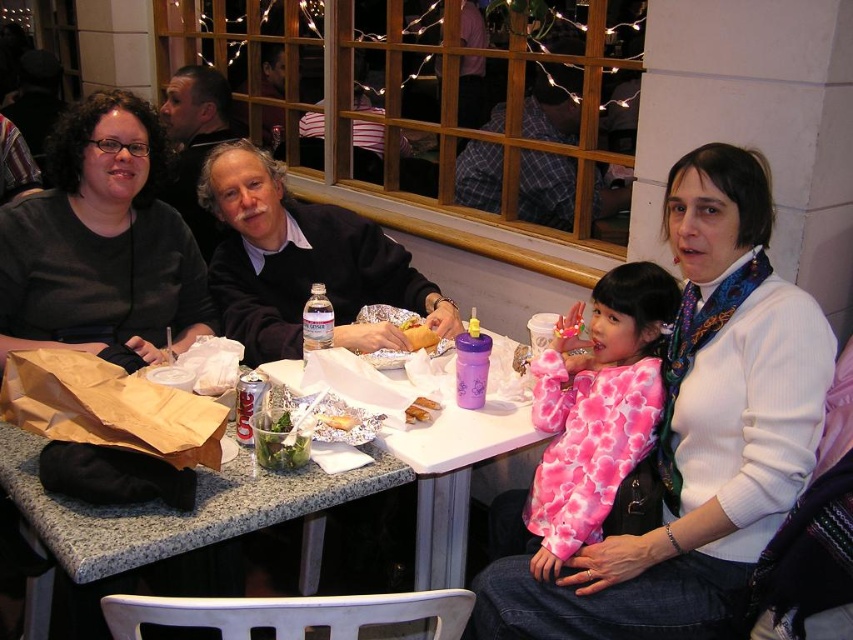
Between pink tie-dye sweater at center and gray knit sweater at center, which one appears on the right side from the viewer's perspective?

pink tie-dye sweater at center is more to the right.

Measure the distance between point (554,376) and camera.

The distance of point (554,376) from camera is 5.77 feet.

Does point (573, 536) come farther from viewer compared to point (212, 237)?

No, (573, 536) is in front of (212, 237).

Find the location of a particular element. The height and width of the screenshot is (640, 853). pink tie-dye sweater at center is located at coordinates (596, 406).

Based on the photo, does dark brown sweater at center appear under golden crispy bread at center?

A: Actually, dark brown sweater at center is above golden crispy bread at center.

Can you confirm if dark brown sweater at center is positioned to the right of golden crispy bread at center?

No, dark brown sweater at center is not to the right of golden crispy bread at center.

The image size is (853, 640). Identify the location of dark brown sweater at center. (303, 262).

Between matte black shirt at left and gray knit sweater at center, which one is positioned higher?

gray knit sweater at center

Which is below, matte black shirt at left or gray knit sweater at center?

matte black shirt at left

Find the location of a particular element. matte black shirt at left is located at coordinates 102,241.